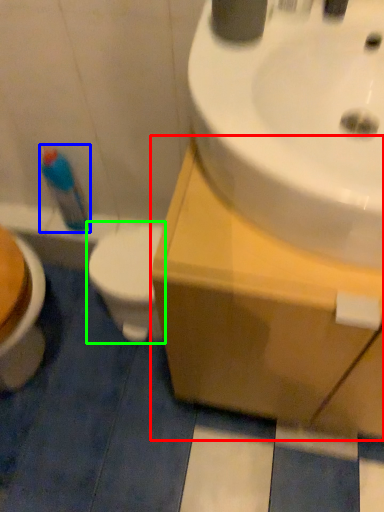
Question: Which object is positioned closest to counter top (highlighted by a red box)? Select from cleaning product (highlighted by a blue box) and toilet (highlighted by a green box).

Choices:
 (A) cleaning product
 (B) toilet

Answer: (B)